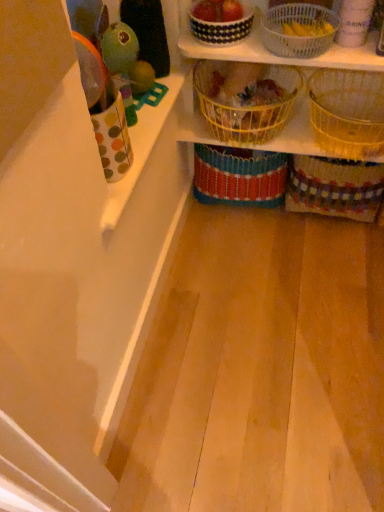
Question: Is point (359, 94) closer or farther from the camera than point (279, 202)?

Choices:
 (A) farther
 (B) closer

Answer: (B)

Question: Do you think woven yellow basket at upper right, which is counted as the fifth basket, starting from the left, is within yellow woven basket at center, the 3th basket when ordered from left to right, or outside of it?

Choices:
 (A) inside
 (B) outside

Answer: (B)

Question: Considering the real-world distances, which object is farthest from the white woven basket at upper center, the 3th basket when ordered from right to left?

Choices:
 (A) yellow wire basket at center, the 2th basket from the left
 (B) black and white checkered basket at upper center, the 1th basket viewed from the left
 (C) multicolored woven basket at lower right, the 6th basket in the left-to-right sequence
 (D) yellow woven basket at center, the 3th basket when ordered from left to right
 (E) polka dot fabric cup at left

Answer: (E)

Question: Which of these objects is positioned closest to the yellow wire basket at center, the 2th basket from the left?

Choices:
 (A) yellow woven basket at center, which ranks as the fourth basket in right-to-left order
 (B) multicolored woven basket at lower right, which appears as the 1th basket when viewed from the right
 (C) woven yellow basket at upper right, which is counted as the fifth basket, starting from the left
 (D) polka dot fabric cup at left
 (E) white woven basket at upper center, the fourth basket positioned from the left

Answer: (A)